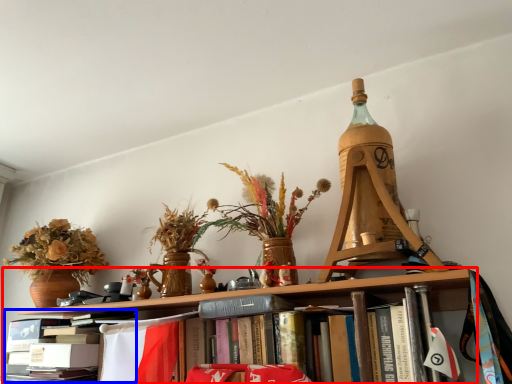
Question: Which object is closer to the camera taking this photo, shelf (highlighted by a red box) or book (highlighted by a blue box)?

Choices:
 (A) shelf
 (B) book

Answer: (A)